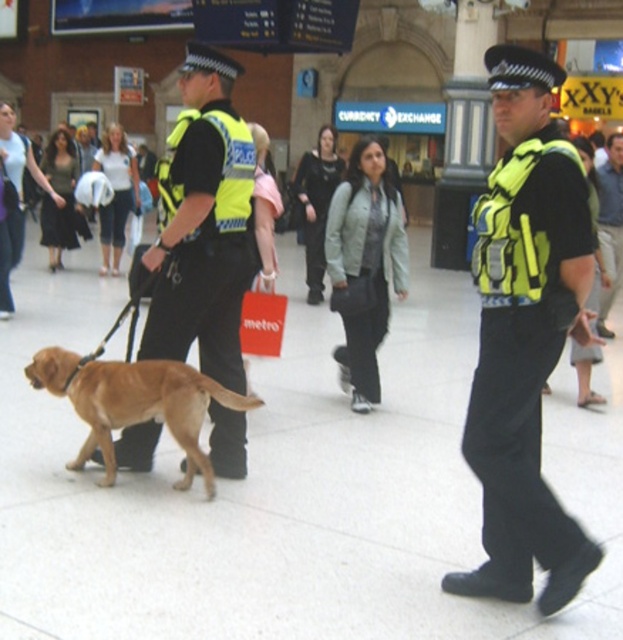
Question: Does golden fur dog at center have a larger size compared to dark green fabric shirt at center?

Choices:
 (A) no
 (B) yes

Answer: (A)

Question: Which object is the farthest from the golden fur dog at center?

Choices:
 (A) high-visibility reflective vest at center
 (B) dark green fabric shirt at center

Answer: (B)

Question: Which of the following is the farthest from the observer?

Choices:
 (A) reflective yellow vest at center
 (B) golden fur dog at center
 (C) dark green fabric shirt at center
 (D) high-visibility reflective vest at center

Answer: (C)

Question: Is reflective yellow vest at center smaller than golden fur dog at center?

Choices:
 (A) no
 (B) yes

Answer: (A)

Question: Can you confirm if golden fur dog at center is thinner than dark green fabric shirt at center?

Choices:
 (A) no
 (B) yes

Answer: (A)

Question: Based on their relative distances, which object is nearer to the reflective yellow vest at center?

Choices:
 (A) golden fur dog at center
 (B) high-visibility reflective vest at center

Answer: (A)